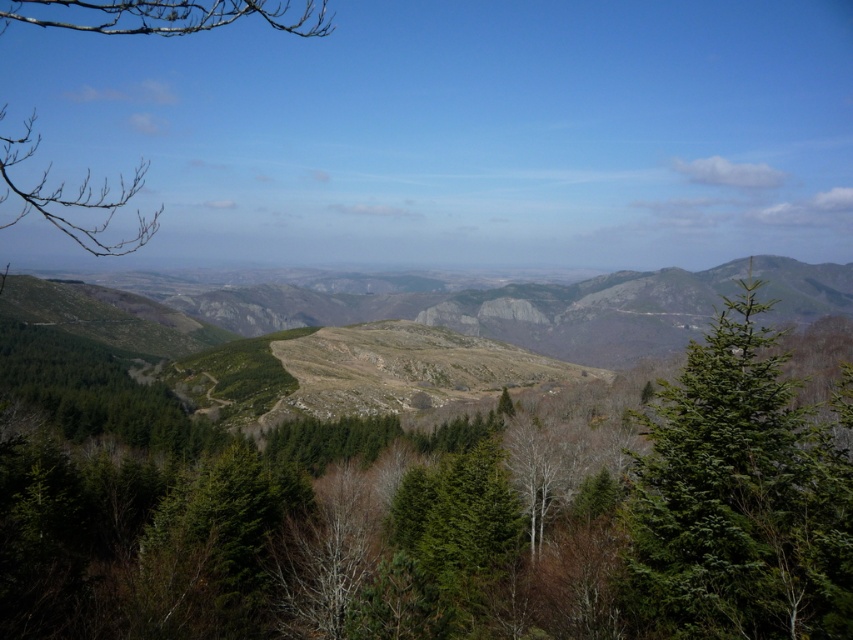
You are an adventurer standing at the starting point of the trail. You want to reach the rugged stone mountain at center. Which direction should you walk to avoid the bare branches at upper left?

The rugged stone mountain at center is closer to you than the bare branches at upper left. To avoid the bare branches at upper left, walk towards the rugged stone mountain at center as it is in front of the branches.

You are a hiker with a 100 meter rope. You are standing at the base of the rugged stone mountain at center. Can you use your rope to reach the summit?

The rugged stone mountain at center is 167.69 meters from viewer. Since the rope is only 100 meters long, it is not long enough to reach the summit.

You are an explorer trying to navigate through the mountainous landscape. You see a green matte tree at center and a bare branches at upper left. Which object is closer to you?

The green matte tree at center is closer to you because the bare branches at upper left is behind it.